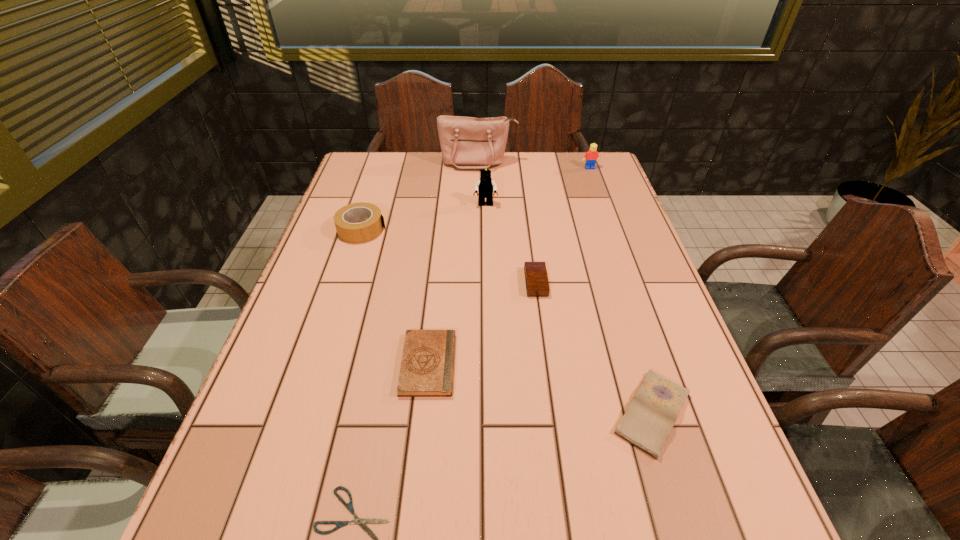
Image resolution: width=960 pixels, height=540 pixels. Find the location of `shoulder bag at the far edge`. shoulder bag at the far edge is located at coordinates (466, 142).

Identify the location of Lego that is at the far edge. (591, 156).

Locate an element on the screen. object present at the left edge is located at coordinates [345, 219].

This screenshot has width=960, height=540. Find the location of `Lego located in the right edge section of the desktop`. Lego located in the right edge section of the desktop is located at coordinates (591, 156).

Where is `diary that is at the right edge`? diary that is at the right edge is located at coordinates (651, 415).

Locate an element on the screen. object that is at the far right corner is located at coordinates (591, 156).

Locate an element on the screen. This screenshot has height=540, width=960. vacant region at the far edge of the desktop is located at coordinates click(560, 167).

This screenshot has height=540, width=960. In the image, there is a desktop. What are the coordinates of `vacant space at the left edge` in the screenshot? It's located at (292, 462).

Image resolution: width=960 pixels, height=540 pixels. In the image, there is a desktop. Find the location of `blank space at the right edge`. blank space at the right edge is located at coordinates point(605,252).

Where is `blank space at the far left corner`? The image size is (960, 540). blank space at the far left corner is located at coordinates (385, 186).